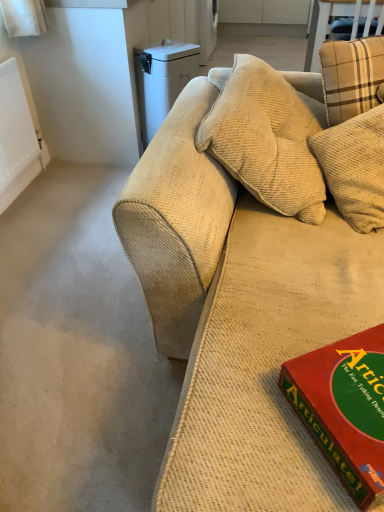
Question: From their relative heights in the image, would you say red matte board game at lower right is taller or shorter than white plastic trash can at upper left?

Choices:
 (A) tall
 (B) short

Answer: (B)

Question: Would you say red matte board game at lower right is inside or outside white plastic trash can at upper left?

Choices:
 (A) inside
 (B) outside

Answer: (B)

Question: Which object is positioned farthest from the beige corduroy couch at center?

Choices:
 (A) red matte board game at lower right
 (B) white plastic trash can at upper left

Answer: (B)

Question: Estimate the real-world distances between objects in this image. Which object is farther from the beige corduroy couch at center?

Choices:
 (A) red matte board game at lower right
 (B) white plastic trash can at upper left

Answer: (B)